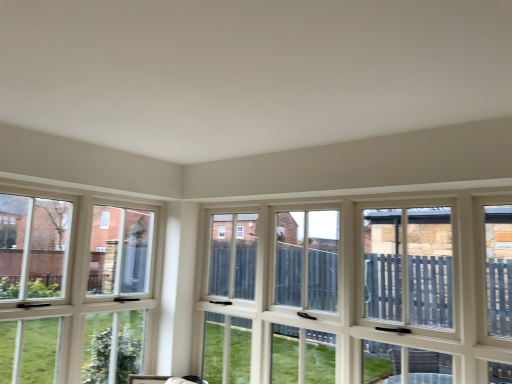
Question: Which direction should I rotate to look at white wood window at center, which is the 1th window from right to left, — up or down?

Choices:
 (A) up
 (B) down

Answer: (B)

Question: Would you say white wood window at left, which is the 2th window from right to left, is outside white wood window at center, which is the 1th window from right to left?

Choices:
 (A) yes
 (B) no

Answer: (A)

Question: Does white wood window at left, which is the 2th window from right to left, lie in front of white wood window at center, the second window when ordered from left to right?

Choices:
 (A) no
 (B) yes

Answer: (A)

Question: Does white wood window at left, which is the 2th window from right to left, have a larger size compared to white wood window at center, the second window when ordered from left to right?

Choices:
 (A) no
 (B) yes

Answer: (A)

Question: Is white wood window at left, the first window viewed from the left, shorter than white wood window at center, the second window when ordered from left to right?

Choices:
 (A) yes
 (B) no

Answer: (B)

Question: Is white wood window at left, the first window viewed from the left, positioned with its back to white wood window at center, which is the 1th window from right to left?

Choices:
 (A) no
 (B) yes

Answer: (A)

Question: From a real-world perspective, is white wood window at left, the first window viewed from the left, positioned over white wood window at center, the second window when ordered from left to right, based on gravity?

Choices:
 (A) no
 (B) yes

Answer: (A)

Question: Considering the relative sizes of white wood window at center, which is the 1th window from right to left, and white wood window at left, which is the 2th window from right to left, in the image provided, is white wood window at center, which is the 1th window from right to left, taller than white wood window at left, which is the 2th window from right to left,?

Choices:
 (A) yes
 (B) no

Answer: (B)

Question: Is white wood window at center, the second window when ordered from left to right, bigger than white wood window at left, which is the 2th window from right to left?

Choices:
 (A) yes
 (B) no

Answer: (A)

Question: From a real-world perspective, is white wood window at center, the second window when ordered from left to right, positioned over white wood window at left, the first window viewed from the left, based on gravity?

Choices:
 (A) yes
 (B) no

Answer: (A)

Question: Is the position of white wood window at center, which is the 1th window from right to left, less distant than that of white wood window at left, which is the 2th window from right to left?

Choices:
 (A) yes
 (B) no

Answer: (A)

Question: Is white wood window at center, which is the 1th window from right to left, further to the viewer compared to white wood window at left, the first window viewed from the left?

Choices:
 (A) yes
 (B) no

Answer: (B)

Question: Is white wood window at center, the second window when ordered from left to right, wider than white wood window at left, the first window viewed from the left?

Choices:
 (A) yes
 (B) no

Answer: (A)

Question: From a real-world perspective, is white wood window at center, which is the 1th window from right to left, above or below white wood window at left, the first window viewed from the left?

Choices:
 (A) above
 (B) below

Answer: (A)